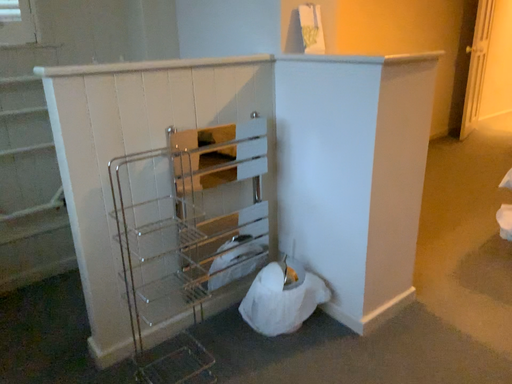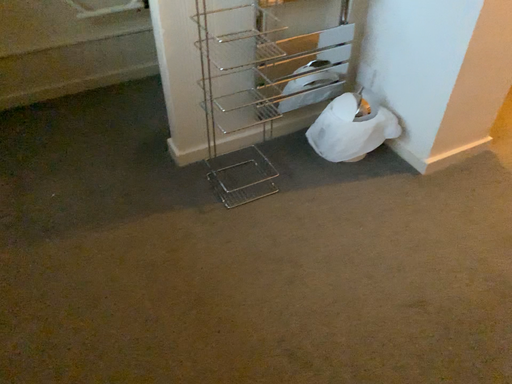
Question: Which way did the camera rotate in the video?

Choices:
 (A) rotated upward
 (B) rotated downward

Answer: (B)